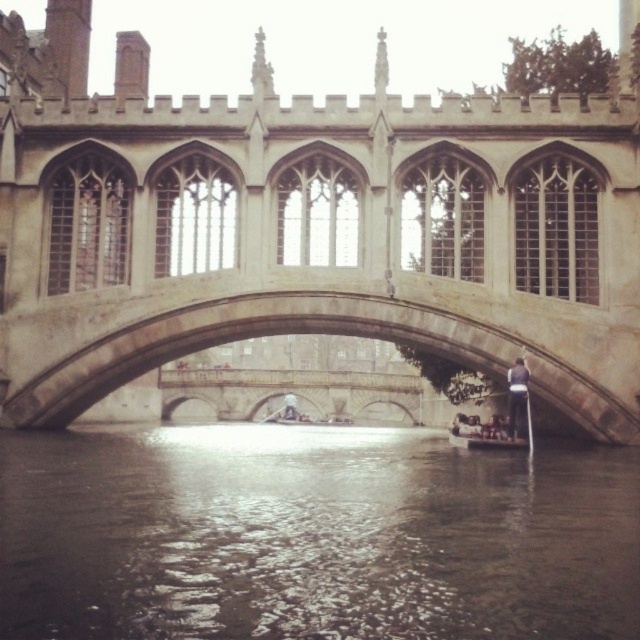
Who is shorter, stone gothic bridge at center or dark water at center?

With less height is dark water at center.

Is stone gothic bridge at center to the right of dark water at center from the viewer's perspective?

No, stone gothic bridge at center is not to the right of dark water at center.

Is point (36, 113) positioned after point (544, 604)?

Yes, it is.

The width and height of the screenshot is (640, 640). I want to click on stone gothic bridge at center, so click(307, 227).

Measure the distance between stone gothic bridge at center and stone bridge at center.

stone gothic bridge at center and stone bridge at center are 7.46 meters apart from each other.

Can you confirm if stone gothic bridge at center is wider than stone bridge at center?

Yes.

Identify the location of stone gothic bridge at center. (307, 227).

Is point (68, 595) farther from camera compared to point (483, 429)?

No, (68, 595) is in front of (483, 429).

Does dark water at center have a greater width compared to wooden boat at lower center?

Indeed, dark water at center has a greater width compared to wooden boat at lower center.

Which is in front, point (77, 433) or point (454, 433)?

Positioned in front is point (77, 433).

What are the coordinates of `dark water at center` in the screenshot? It's located at tap(312, 538).